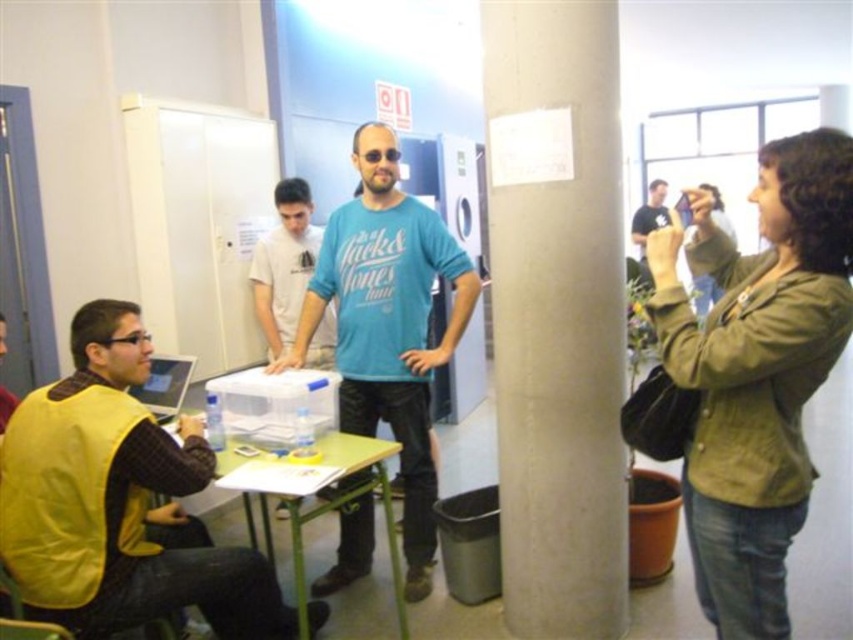
Does concrete pillar at center have a smaller size compared to white plastic container at center?

No.

The height and width of the screenshot is (640, 853). Describe the element at coordinates (560, 324) in the screenshot. I see `concrete pillar at center` at that location.

What are the coordinates of `concrete pillar at center` in the screenshot? It's located at (560, 324).

Can you confirm if yellow fabric vest at lower left is positioned to the right of matte black laptop at left?

Correct, you'll find yellow fabric vest at lower left to the right of matte black laptop at left.

Which is in front, point (19, 582) or point (154, 381)?

Positioned in front is point (19, 582).

Identify the location of yellow fabric vest at lower left. The width and height of the screenshot is (853, 640). (119, 500).

Is yellow fabric vest at lower left below dark blue t-shirt at upper right?

Yes.

Which is behind, point (10, 540) or point (660, 179)?

The point (660, 179) is more distant.

Find the location of a particular element. The height and width of the screenshot is (640, 853). yellow fabric vest at lower left is located at coordinates (119, 500).